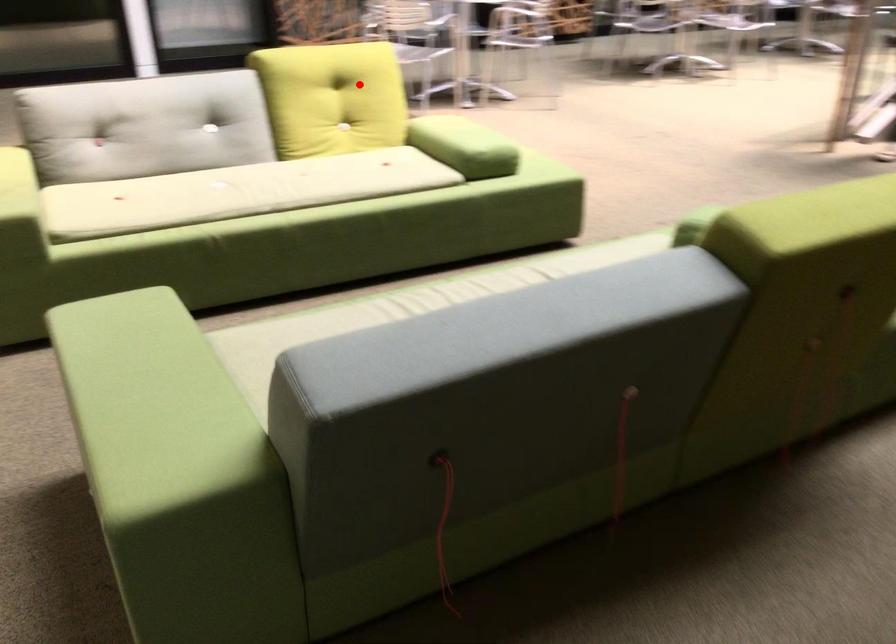
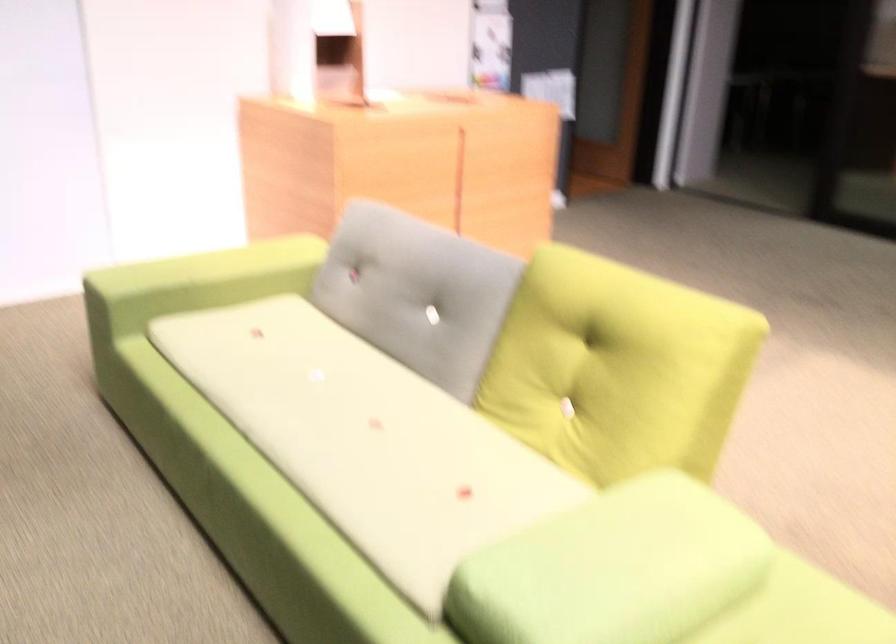
Question: I am providing you with two images of the same scene from different viewpoints. Image1 has a red point marked. In image2, the corresponding 3D location appears at what relative position? Reply with the corresponding letter.

Choices:
 (A) Closer
 (B) Farther

Answer: (A)